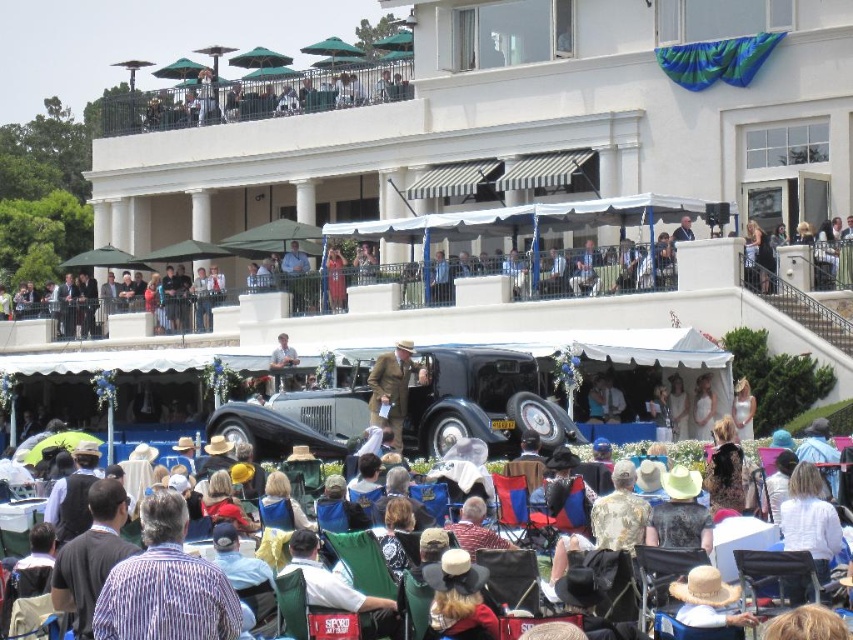
Question: Which point appears closest to the camera in this image?

Choices:
 (A) (778, 602)
 (B) (548, 448)
 (C) (397, 435)

Answer: (A)

Question: Estimate the real-world distances between objects in this image. Which object is closer to the metallic silver chair at center?

Choices:
 (A) brown wool coat at center
 (B) striped cotton shirt at center
 (C) shiny black car at center
 (D) striped cotton shirt at lower left

Answer: (D)

Question: Can you confirm if shiny black car at center is smaller than metallic silver chair at center?

Choices:
 (A) no
 (B) yes

Answer: (A)

Question: Can you confirm if striped cotton shirt at lower left is thinner than brown wool coat at center?

Choices:
 (A) no
 (B) yes

Answer: (B)

Question: Which point appears closest to the camera in this image?

Choices:
 (A) (782, 605)
 (B) (376, 369)
 (C) (141, 568)
 (D) (532, 408)

Answer: (C)

Question: Does striped cotton shirt at lower left have a lesser width compared to brown wool coat at center?

Choices:
 (A) no
 (B) yes

Answer: (B)